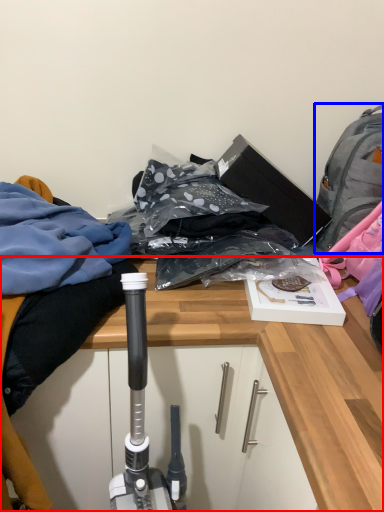
Question: Which object appears closest to the camera in this image, desk (highlighted by a red box) or backpack (highlighted by a blue box)?

Choices:
 (A) desk
 (B) backpack

Answer: (A)